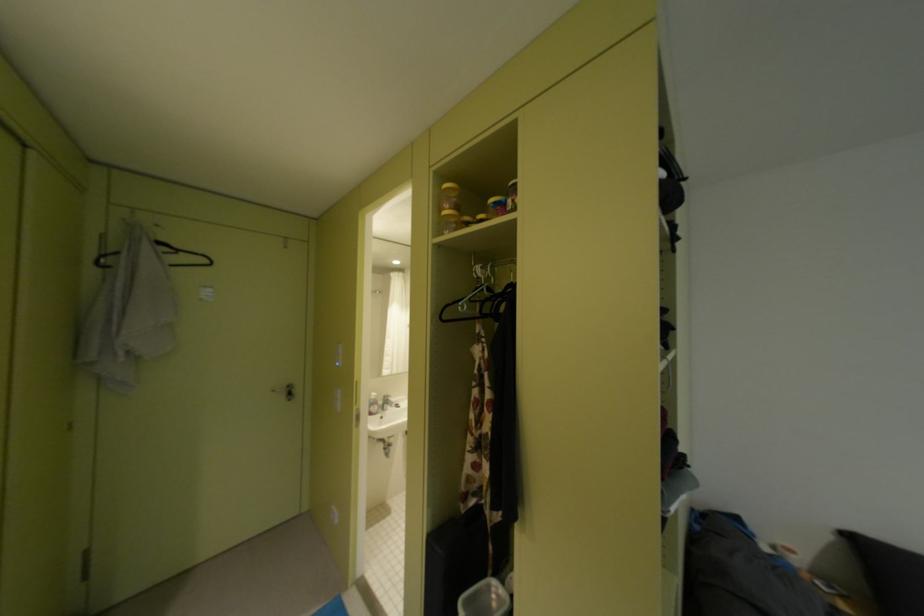
Find the location of a particular element. The width and height of the screenshot is (924, 616). silver door handle is located at coordinates (286, 391).